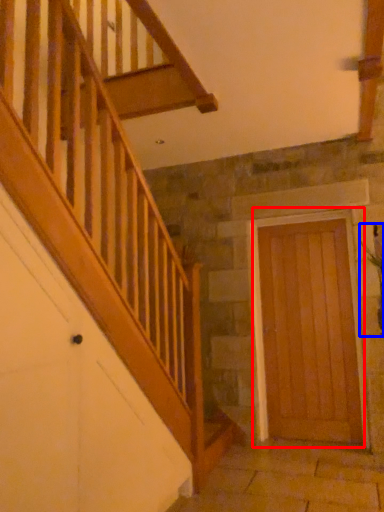
Question: Which object appears farthest to the camera in this image, door (highlighted by a red box) or plant (highlighted by a blue box)?

Choices:
 (A) door
 (B) plant

Answer: (A)